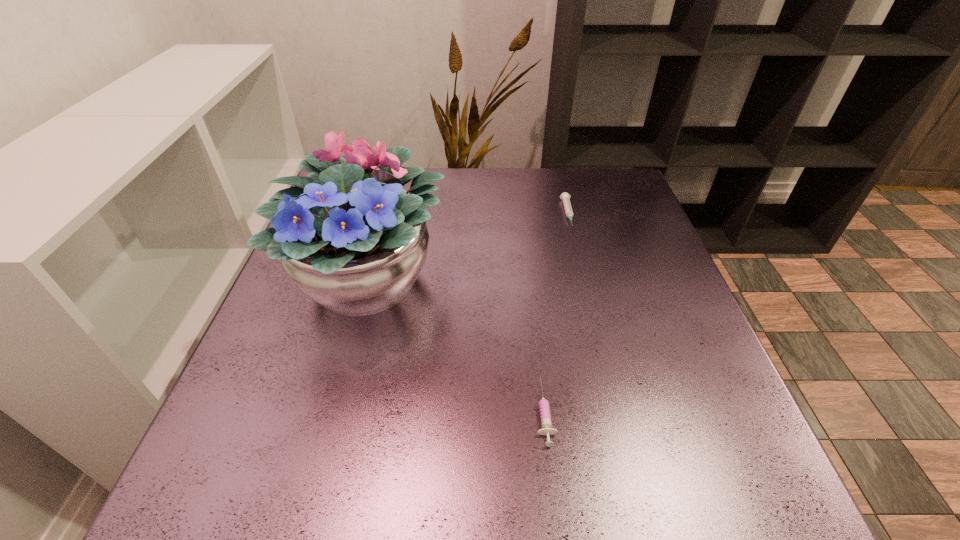
Where is `unoccupied position between the bouquet and the left syringe`? The height and width of the screenshot is (540, 960). unoccupied position between the bouquet and the left syringe is located at coordinates (458, 346).

This screenshot has height=540, width=960. I want to click on free spot between the nearest object and the rightmost object, so click(556, 313).

This screenshot has height=540, width=960. What are the coordinates of `free space between the nearer syringe and the leftmost object` in the screenshot? It's located at (458, 346).

This screenshot has height=540, width=960. I want to click on vacant space that's between the farther syringe and the tallest object, so click(469, 247).

This screenshot has width=960, height=540. Identify the location of vacant area between the nearest object and the right syringe. (556, 313).

Find the location of `empty space between the tallest object and the nearer syringe`. empty space between the tallest object and the nearer syringe is located at coordinates (458, 346).

Find the location of a particular element. free space that is in between the bouquet and the second object from left to right is located at coordinates (458, 346).

Locate which object is the second closest to the farther syringe. Please provide its 2D coordinates. Your answer should be formatted as a tuple, i.e. [(x, y)], where the tuple contains the x and y coordinates of a point satisfying the conditions above.

[(545, 416)]

Identify which object is the second nearest to the rightmost object. Please provide its 2D coordinates. Your answer should be formatted as a tuple, i.e. [(x, y)], where the tuple contains the x and y coordinates of a point satisfying the conditions above.

[(545, 416)]